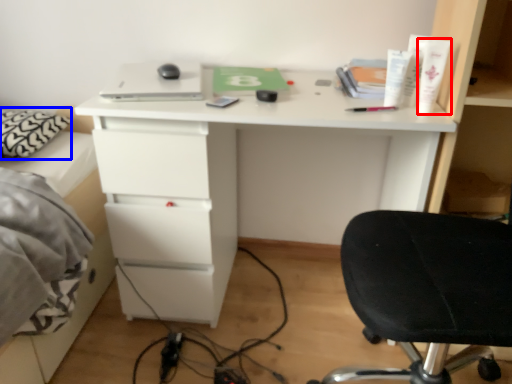
Question: Among these objects, which one is nearest to the camera, toiletry (highlighted by a red box) or pillow (highlighted by a blue box)?

Choices:
 (A) toiletry
 (B) pillow

Answer: (A)